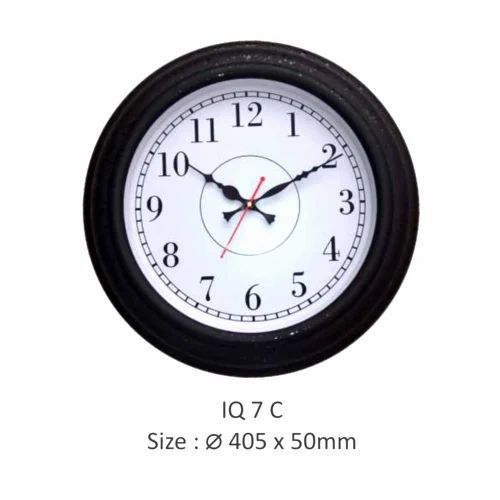
Where is `frame of clock`? This screenshot has width=500, height=500. frame of clock is located at coordinates (384, 282).